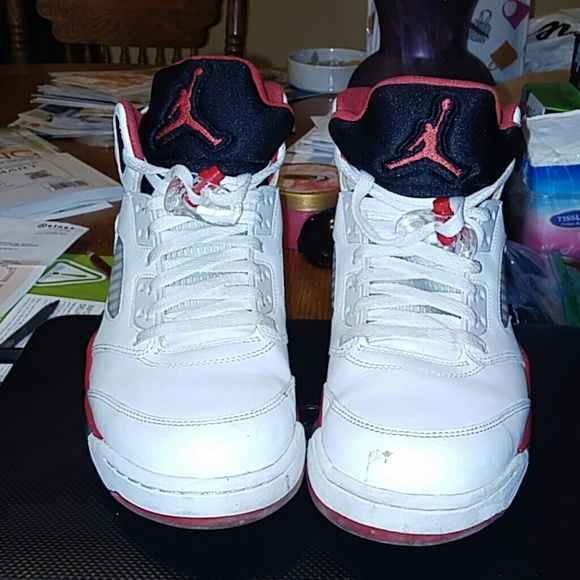
This screenshot has width=580, height=580. In order to click on scented candle in this screenshot , I will do `click(307, 188)`.